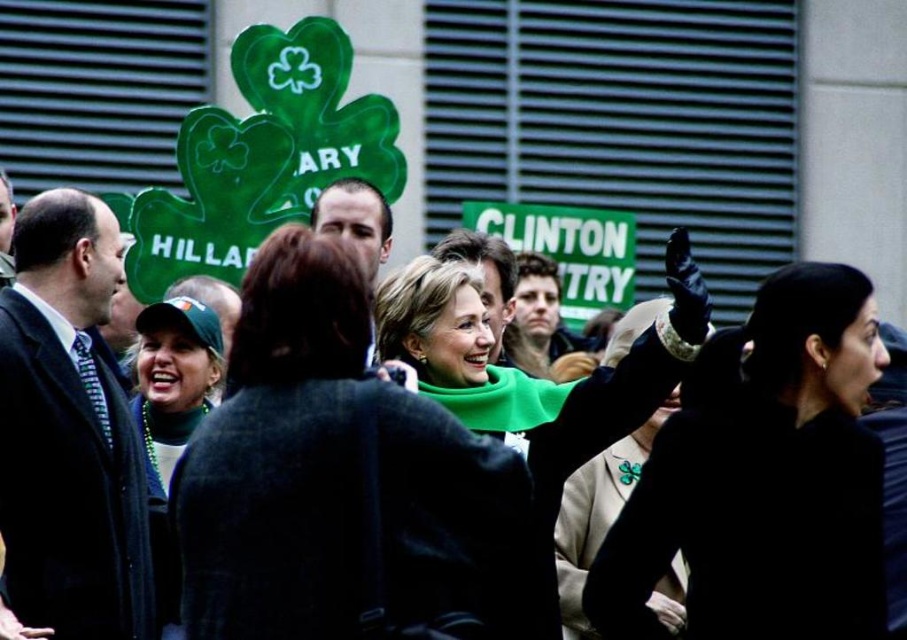
Does dark brown hair at center appear on the right side of smooth brown hair at center?

Incorrect, dark brown hair at center is not on the right side of smooth brown hair at center.

Is dark brown hair at center shorter than smooth brown hair at center?

Yes, dark brown hair at center is shorter than smooth brown hair at center.

Does point (337, 211) lie behind point (450, 259)?

No, (337, 211) is closer to viewer.

I want to click on dark brown hair at center, so click(356, 220).

Does dark blue suit at left have a lesser height compared to dark brown hair at center?

No.

Is point (40, 588) behind point (373, 264)?

No, (40, 588) is closer to viewer.

Is point (7, 536) positioned after point (369, 188)?

No, (7, 536) is closer to viewer.

Image resolution: width=907 pixels, height=640 pixels. I want to click on dark blue suit at left, so click(x=69, y=433).

Who is shorter, black satin dress at right or dark blue suit at left?

black satin dress at right is shorter.

In the scene shown: Does black satin dress at right have a lesser height compared to dark blue suit at left?

Yes.

Between point (713, 392) and point (47, 310), which one is positioned in front?

Point (713, 392) is more forward.

I want to click on black satin dress at right, so click(x=762, y=477).